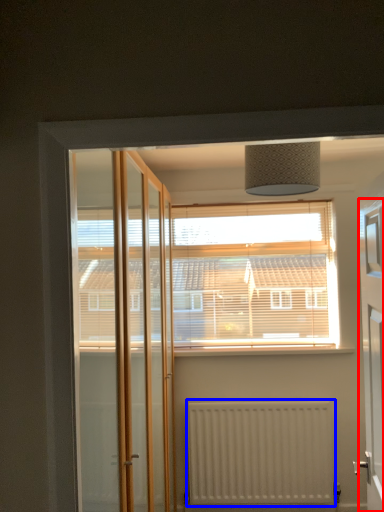
Question: Which object appears farthest to the camera in this image, elevator (highlighted by a red box) or radiator (highlighted by a blue box)?

Choices:
 (A) elevator
 (B) radiator

Answer: (B)